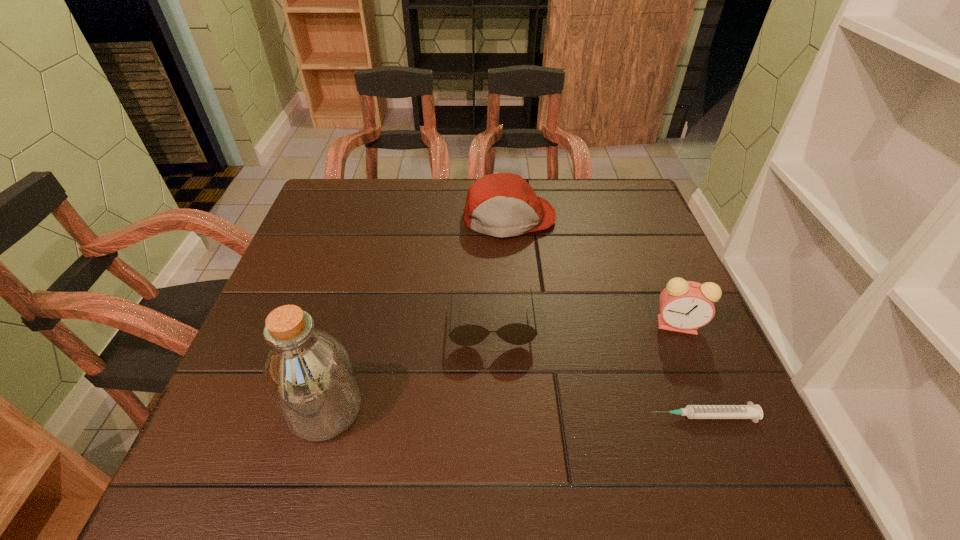
Where is `bottle`? bottle is located at coordinates (308, 375).

You are a GUI agent. You are given a task and a screenshot of the screen. Output one action in this format:
    pyautogui.click(x=<x>, y=<y>)
    Task: Click on the leftmost object
    This screenshot has height=540, width=960.
    Given the screenshot: What is the action you would take?
    pyautogui.click(x=308, y=375)

Find the location of a particular element. The width and height of the screenshot is (960, 540). the shortest object is located at coordinates (750, 411).

Where is `alarm clock`? alarm clock is located at coordinates (685, 306).

Identify the location of cap. This screenshot has width=960, height=540. (501, 205).

The width and height of the screenshot is (960, 540). Find the location of `sunglasses`. sunglasses is located at coordinates (518, 334).

The width and height of the screenshot is (960, 540). I want to click on free space located 0.170m on the back of the bottle, so click(x=352, y=312).

Find the location of a particular element. This screenshot has width=960, height=540. free region located at the needle end of the syringe is located at coordinates (550, 416).

I want to click on free space located 0.190m at the needle end of the syringe, so pyautogui.click(x=544, y=416).

I want to click on vacant position located 0.210m at the needle end of the syringe, so click(534, 416).